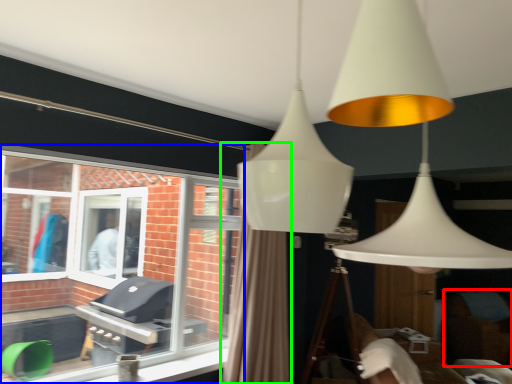
Question: Which object is the closest to the swivel chair (highlighted by a red box)? Choose among these: window (highlighted by a blue box) or curtain (highlighted by a green box).

Choices:
 (A) window
 (B) curtain

Answer: (B)